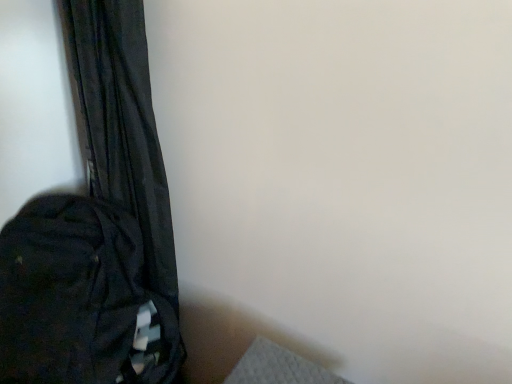
Question: From the image's perspective, is black fabric backpack at lower left positioned above or below black fabric curtain at left?

Choices:
 (A) below
 (B) above

Answer: (A)

Question: Is black fabric backpack at lower left inside the boundaries of black fabric curtain at left, or outside?

Choices:
 (A) outside
 (B) inside

Answer: (A)

Question: Is point (53, 379) positioned closer to the camera than point (157, 185)?

Choices:
 (A) closer
 (B) farther

Answer: (A)

Question: Would you say black fabric curtain at left is inside or outside black fabric backpack at lower left?

Choices:
 (A) outside
 (B) inside

Answer: (A)

Question: From a real-world perspective, relative to black fabric backpack at lower left, is black fabric curtain at left vertically above or below?

Choices:
 (A) above
 (B) below

Answer: (A)

Question: From their relative heights in the image, would you say black fabric curtain at left is taller or shorter than black fabric backpack at lower left?

Choices:
 (A) tall
 (B) short

Answer: (A)

Question: Is black fabric curtain at left to the left or to the right of black fabric backpack at lower left in the image?

Choices:
 (A) right
 (B) left

Answer: (A)